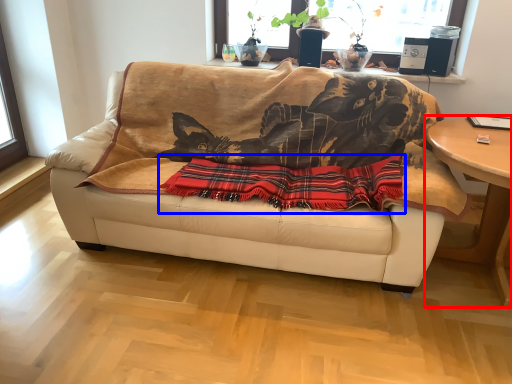
Question: Among these objects, which one is nearest to the camera, table (highlighted by a red box) or plaid (highlighted by a blue box)?

Choices:
 (A) table
 (B) plaid

Answer: (A)